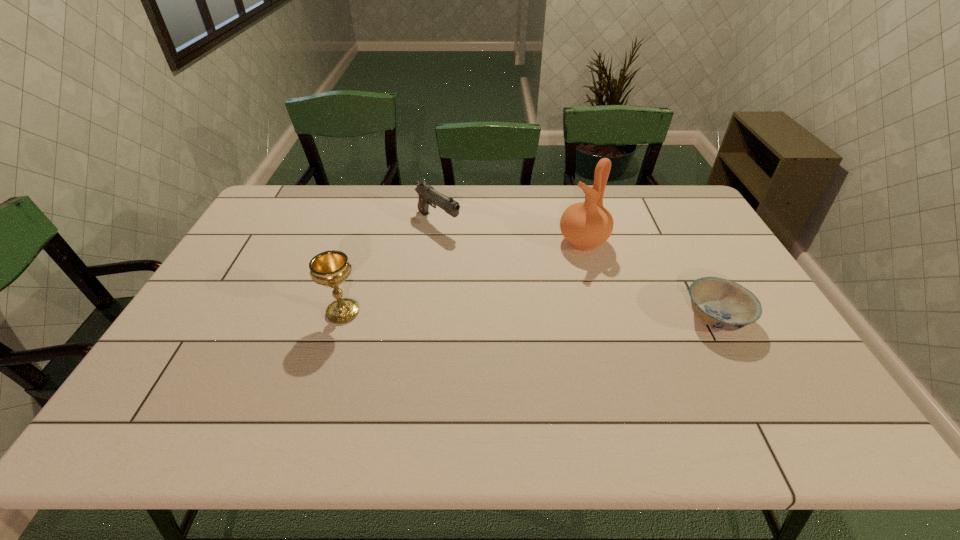
Where is `free space located on the spout of the pottery`? The height and width of the screenshot is (540, 960). free space located on the spout of the pottery is located at coordinates (489, 305).

The width and height of the screenshot is (960, 540). Find the location of `free space located on the spout of the pottery`. free space located on the spout of the pottery is located at coordinates [x=472, y=315].

Where is `free spot located 0.080m on the spout of the pottery`? The image size is (960, 540). free spot located 0.080m on the spout of the pottery is located at coordinates (550, 264).

The height and width of the screenshot is (540, 960). Identify the location of free space located in the direction the third object from right to left is aimed. tap(525, 280).

Where is `vacant space located 0.310m in the direction the third object from right to left is aimed`? Image resolution: width=960 pixels, height=540 pixels. vacant space located 0.310m in the direction the third object from right to left is aimed is located at coordinates (522, 278).

Locate an element on the screen. This screenshot has height=540, width=960. vacant space positioned 0.220m in the direction the third object from right to left is aimed is located at coordinates (501, 264).

I want to click on object located at the far edge, so click(x=427, y=195).

At what (x,y) coordinates should I click in order to perform the action: click on object that is at the right edge. Please return your answer as a coordinate pair (x, y). Looking at the image, I should click on (722, 304).

Identify the location of free region at the far edge of the desktop. This screenshot has height=540, width=960. click(x=500, y=219).

This screenshot has width=960, height=540. In the image, there is a desktop. In order to click on vacant space at the near edge in this screenshot , I will do `click(453, 370)`.